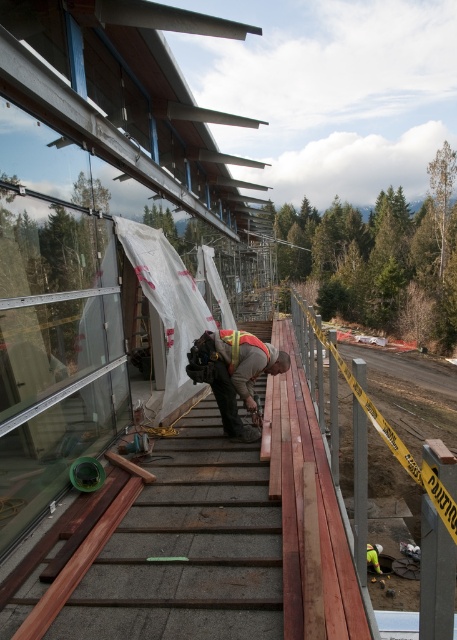
Does reflective safety vest at center have a smaller size compared to reflective orange safety vest at center?

Incorrect, reflective safety vest at center is not smaller in size than reflective orange safety vest at center.

Find the location of a particular element. reflective safety vest at center is located at coordinates (233, 372).

Measure the distance between point (233, 428) and camera.

Point (233, 428) is 4.59 meters from camera.

Find the location of a particular element. This screenshot has height=640, width=457. reflective safety vest at center is located at coordinates (233, 372).

Is smooth wood stairs at center taller than reflective safety vest at center?

In fact, smooth wood stairs at center may be shorter than reflective safety vest at center.

Which is in front, point (228, 525) or point (238, 371)?

Point (228, 525)

What are the coordinates of `smooth wood stairs at center` in the screenshot? It's located at (161, 550).

Is smooth wood stairs at center above reflective orange safety vest at center?

No, smooth wood stairs at center is not above reflective orange safety vest at center.

Between smooth wood stairs at center and reflective orange safety vest at center, which one appears on the left side from the viewer's perspective?

smooth wood stairs at center

Which is behind, point (152, 548) or point (239, 356)?

The point (239, 356) is behind.

Find the location of a particular element. smooth wood stairs at center is located at coordinates (161, 550).